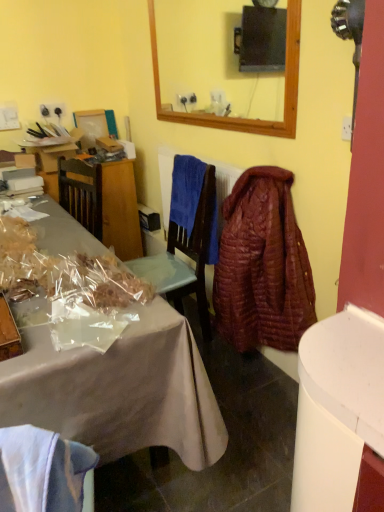
Question: Is quilted brown robe at center right further to camera compared to metallic cardboard box at lower left?

Choices:
 (A) yes
 (B) no

Answer: (A)

Question: Could you tell me if quilted brown robe at center right is turned towards metallic cardboard box at lower left?

Choices:
 (A) no
 (B) yes

Answer: (B)

Question: Is quilted brown robe at center right not near metallic cardboard box at lower left?

Choices:
 (A) yes
 (B) no

Answer: (A)

Question: From a real-world perspective, is quilted brown robe at center right below metallic cardboard box at lower left?

Choices:
 (A) no
 (B) yes

Answer: (A)

Question: Can you confirm if quilted brown robe at center right is positioned to the left of metallic cardboard box at lower left?

Choices:
 (A) no
 (B) yes

Answer: (A)

Question: Does quilted brown robe at center right have a lesser width compared to metallic cardboard box at lower left?

Choices:
 (A) no
 (B) yes

Answer: (B)

Question: Is metallic cardboard box at lower left bigger than blue soft towel at center?

Choices:
 (A) yes
 (B) no

Answer: (B)

Question: Is metallic cardboard box at lower left taller than blue soft towel at center?

Choices:
 (A) no
 (B) yes

Answer: (A)

Question: Does metallic cardboard box at lower left turn towards blue soft towel at center?

Choices:
 (A) no
 (B) yes

Answer: (A)

Question: Is metallic cardboard box at lower left at the left side of blue soft towel at center?

Choices:
 (A) yes
 (B) no

Answer: (A)

Question: Is metallic cardboard box at lower left not within blue soft towel at center?

Choices:
 (A) no
 (B) yes

Answer: (B)

Question: Is blue soft towel at center at the back of metallic cardboard box at lower left?

Choices:
 (A) yes
 (B) no

Answer: (B)

Question: Is metallic cardboard box at lower left aimed at quilted brown robe at center right?

Choices:
 (A) yes
 (B) no

Answer: (B)